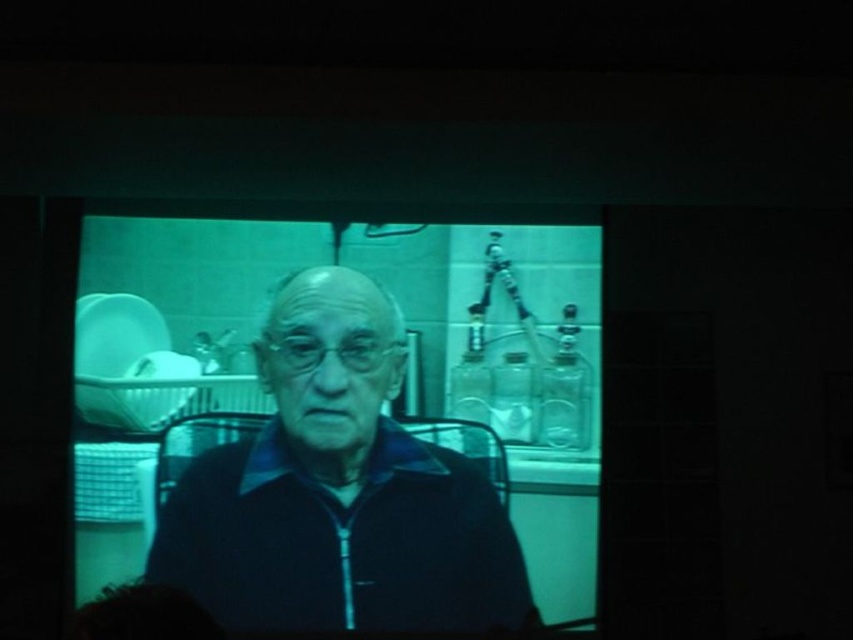
Does dark blue zip-up jacket at center appear on the right side of dark hair at lower left?

Indeed, dark blue zip-up jacket at center is positioned on the right side of dark hair at lower left.

Who is more forward, (212,605) or (149,582)?

Point (149,582) is more forward.

Between point (374, 317) and point (157, 604), which one is positioned in front?

Point (157, 604) is in front.

This screenshot has width=853, height=640. What are the coordinates of `dark blue zip-up jacket at center` in the screenshot? It's located at (338, 492).